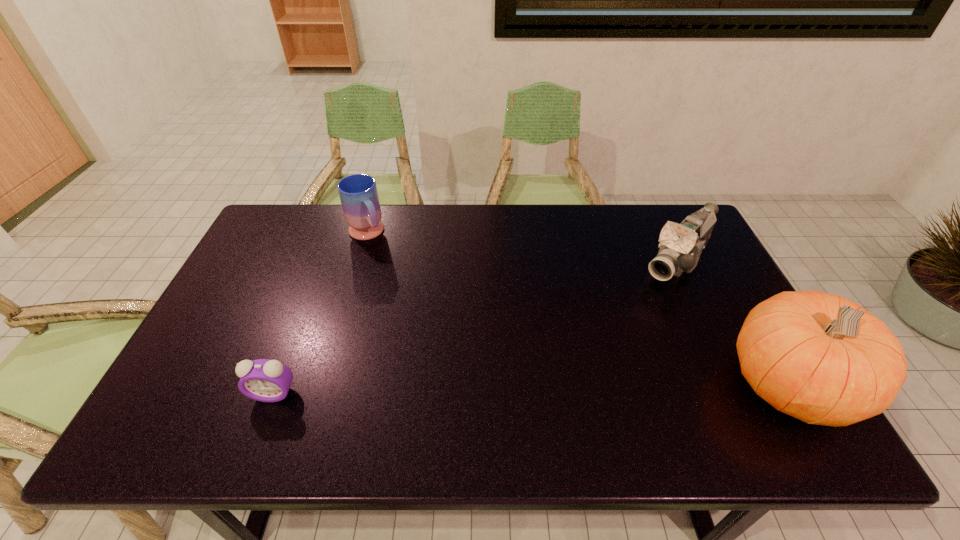
Locate an element on the screen. The width and height of the screenshot is (960, 540). blank space at the left edge is located at coordinates (285, 272).

The width and height of the screenshot is (960, 540). I want to click on free spot between the mug and the camcorder, so click(x=521, y=247).

Find the location of a particular element. This screenshot has height=540, width=960. free area in between the mug and the tallest object is located at coordinates (578, 309).

Where is `free area in between the camcorder and the shortest object`? This screenshot has width=960, height=540. free area in between the camcorder and the shortest object is located at coordinates (475, 327).

Locate an element on the screen. The height and width of the screenshot is (540, 960). free point between the camcorder and the alarm clock is located at coordinates (475, 327).

Find the location of a particular element. vacant space that is in between the mug and the pumpkin is located at coordinates (578, 309).

At what (x,y) coordinates should I click in order to perform the action: click on empty space between the tallest object and the camcorder. Please return your answer as a coordinate pair (x, y). This screenshot has height=540, width=960. Looking at the image, I should click on (732, 323).

This screenshot has height=540, width=960. In order to click on empty location between the mug and the shortest object in this screenshot , I will do `click(321, 314)`.

At what (x,y) coordinates should I click in order to perform the action: click on free space between the pumpkin and the shortest object. Please return your answer as a coordinate pair (x, y). Looking at the image, I should click on (531, 389).

This screenshot has width=960, height=540. In order to click on vacant area between the camcorder and the alarm clock in this screenshot , I will do `click(475, 327)`.